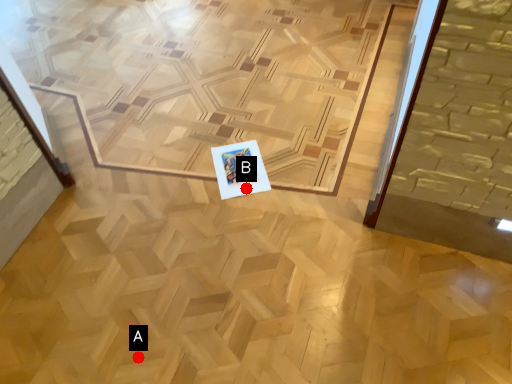
Question: Two points are circled on the image, labeled by A and B beside each circle. Among these points, which one is farthest from the camera?

Choices:
 (A) A is further
 (B) B is further

Answer: (B)